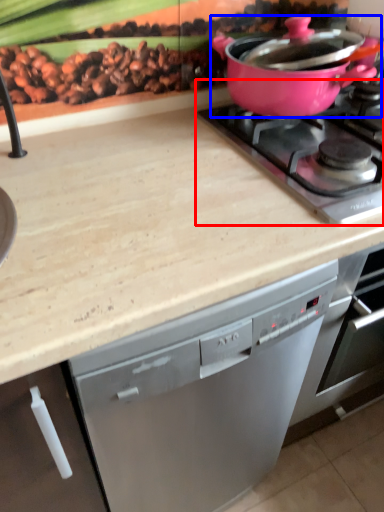
Question: Among these objects, which one is nearest to the camera, gas stove (highlighted by a red box) or kitchen appliance (highlighted by a blue box)?

Choices:
 (A) gas stove
 (B) kitchen appliance

Answer: (A)